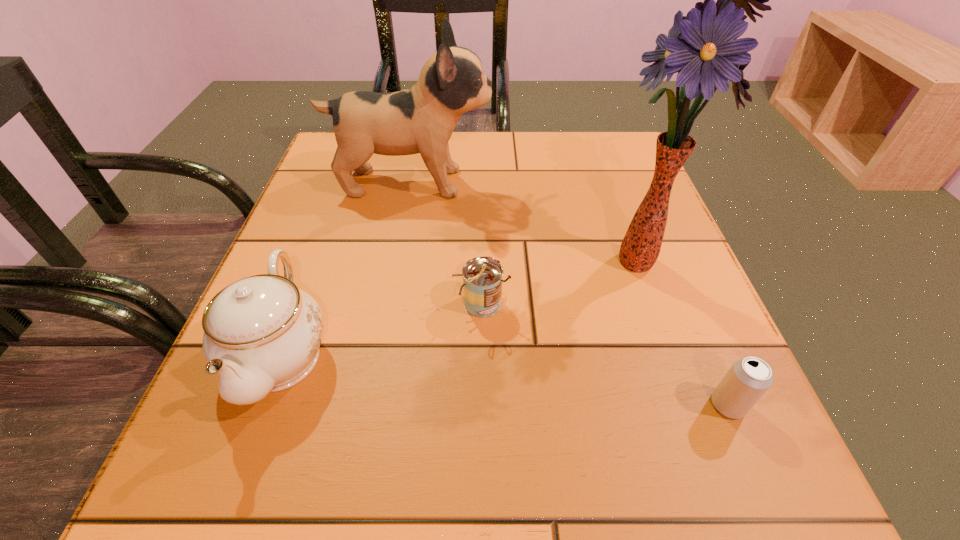
Find the location of a particular element. free space between the flower arrangement and the can is located at coordinates (559, 281).

Image resolution: width=960 pixels, height=540 pixels. I want to click on free space between the fourth tallest object and the chinaware, so click(x=381, y=329).

Locate an element on the screen. blank region between the chinaware and the tallest object is located at coordinates (460, 307).

Find the location of `object that is the second closest to the can`. object that is the second closest to the can is located at coordinates click(x=262, y=334).

In order to click on the closest object to the fourth tallest object in this screenshot , I will do `click(703, 48)`.

Where is `vacant space that satisfies the following two spatial constraints: 1. on the front side of the shortest object; 2. on the right side of the tallest object`? This screenshot has height=540, width=960. vacant space that satisfies the following two spatial constraints: 1. on the front side of the shortest object; 2. on the right side of the tallest object is located at coordinates (689, 405).

I want to click on vacant space that satisfies the following two spatial constraints: 1. at the spout of the chinaware; 2. on the left side of the beer can, so click(x=264, y=405).

Find the location of a particular element. The height and width of the screenshot is (540, 960). vacant area that satisfies the following two spatial constraints: 1. at the face of the shortest object; 2. on the left side of the fourth shortest object is located at coordinates (370, 405).

I want to click on free space that satisfies the following two spatial constraints: 1. at the face of the farthest object; 2. on the left side of the can, so click(389, 303).